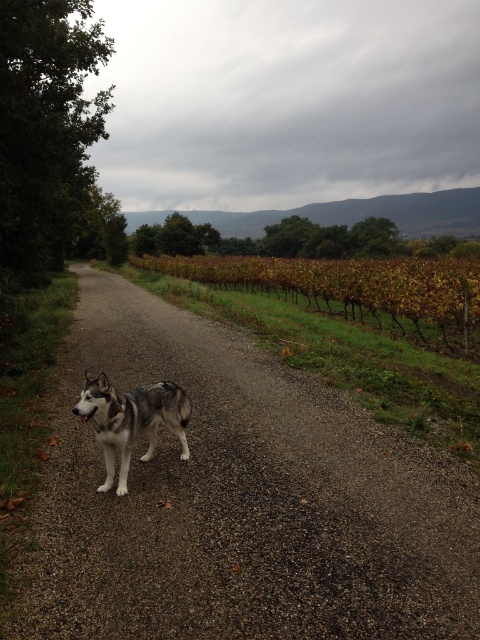
Question: Which object is the closest to the gray fur dog at center?

Choices:
 (A) green leafy vines at center
 (B) gray gravel road at center

Answer: (B)

Question: Does green leafy vines at center lie in front of gray fur dog at center?

Choices:
 (A) yes
 (B) no

Answer: (B)

Question: Estimate the real-world distances between objects in this image. Which object is farther from the gray gravel road at center?

Choices:
 (A) green leafy vines at center
 (B) gray fur dog at center

Answer: (A)

Question: Among these points, which one is farthest from the camera?

Choices:
 (A) (180, 266)
 (B) (112, 460)

Answer: (A)

Question: Is gray gravel road at center smaller than gray fur dog at center?

Choices:
 (A) yes
 (B) no

Answer: (B)

Question: Is green leafy vines at center closer to camera compared to gray fur dog at center?

Choices:
 (A) yes
 (B) no

Answer: (B)